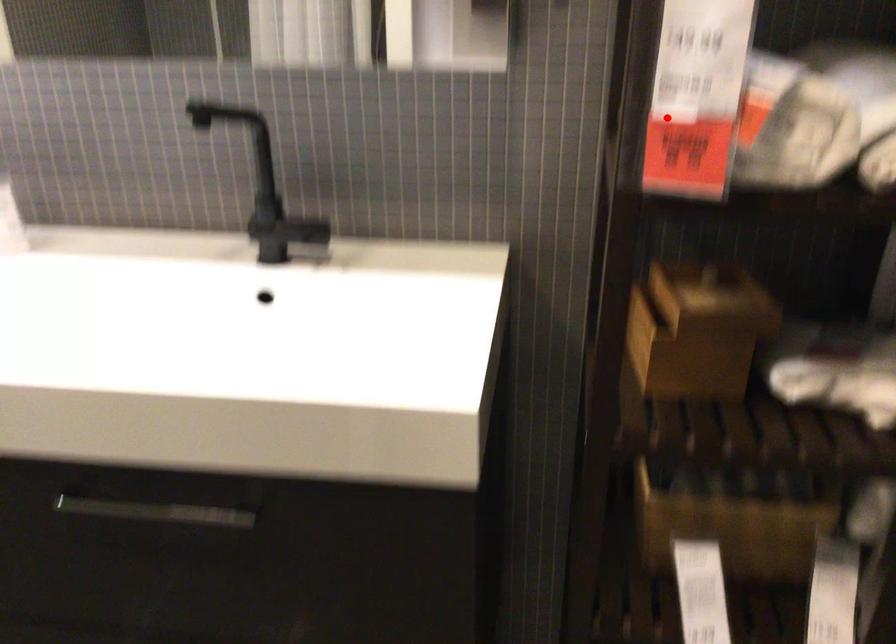
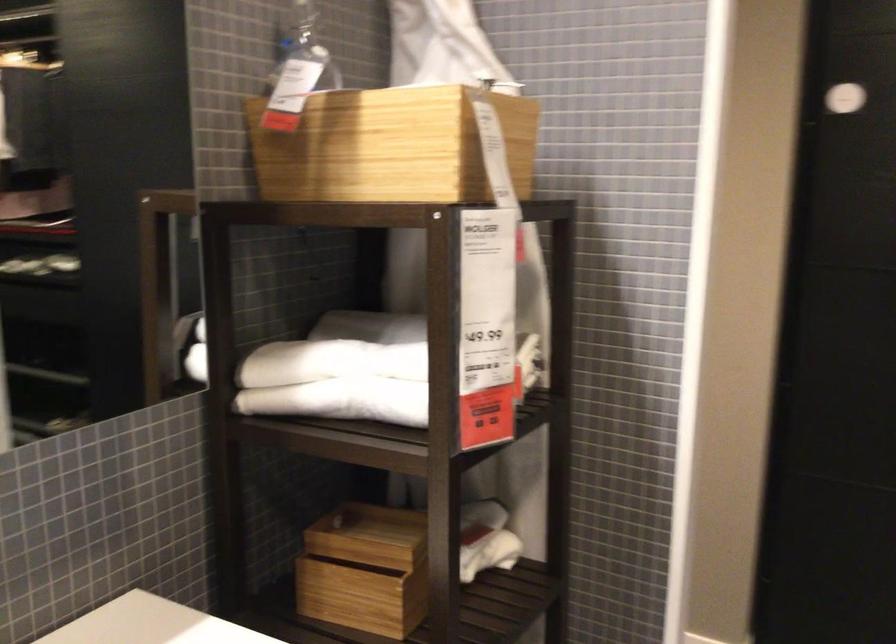
Question: I am providing you with two images of the same scene from different viewpoints. In image1, a red point is highlighted. Considering the same 3D point in image2, which of the following is correct?

Choices:
 (A) It is closer
 (B) It is farther

Answer: (B)